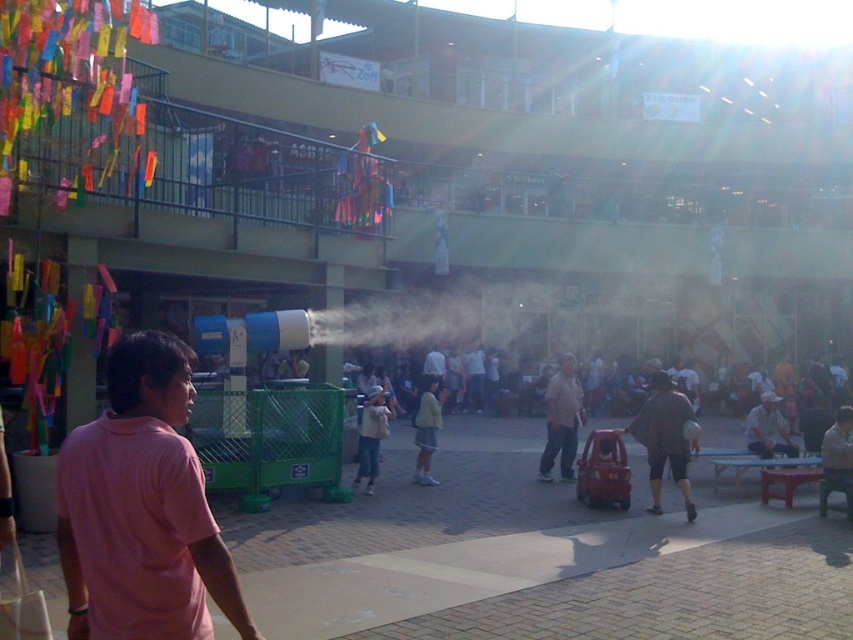
You are standing in the courtyard and want to approach the dark gray fabric shirt at center to ask a question. If you walk directly towards it, how far will you have to walk?

You will have to walk 9.87 meters to reach the dark gray fabric shirt at center since that is the distance between you and the shirt.

You are standing at the entrance of the courtyard and want to find the pink cotton shirt at center. According to the coordinates provided, in which direction should you move relative to your current position?

The pink cotton shirt at center is located at coordinates point (142,509), which means you should move towards the lower right direction from your current position at the entrance.

You are a photographer trying to capture both the dark gray fabric shirt at center and the light brown fabric shirt at center in a single shot. Which shirt will appear more visible in the photo?

The dark gray fabric shirt at center is positioned over light brown fabric shirt at center, so the dark gray fabric shirt at center will appear more visible in the photo as it is in front.